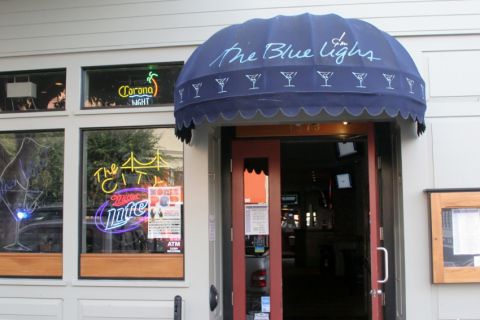
Find the location of a particular element. lights is located at coordinates (344, 172).